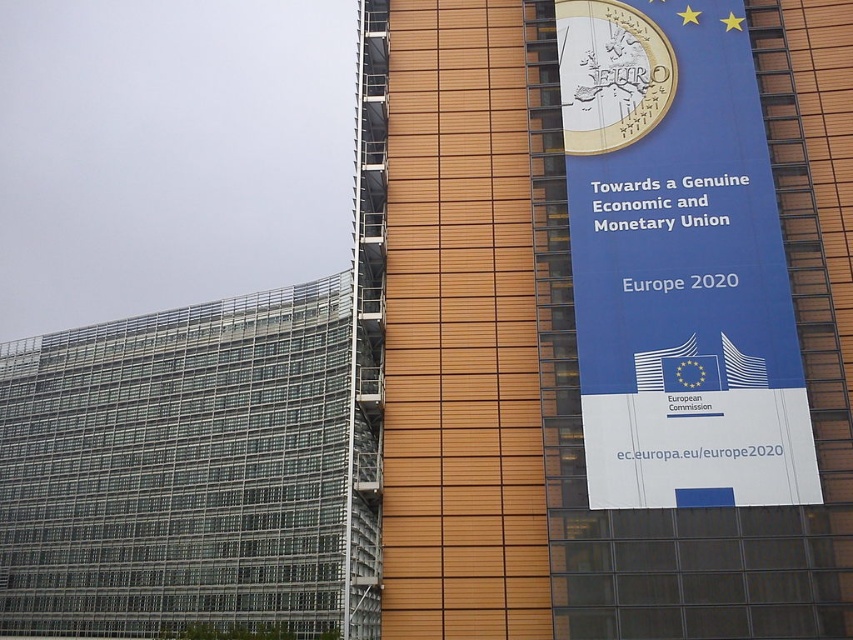
Question: Which object appears closest to the camera in this image?

Choices:
 (A) blue paper banner at upper right
 (B) blue fabric banner at upper center

Answer: (B)

Question: Is blue fabric banner at upper center above blue paper banner at upper right?

Choices:
 (A) no
 (B) yes

Answer: (A)

Question: Is blue fabric banner at upper center positioned at the back of blue paper banner at upper right?

Choices:
 (A) yes
 (B) no

Answer: (B)

Question: Which of the following is the closest to the observer?

Choices:
 (A) (633, 481)
 (B) (679, 621)

Answer: (B)

Question: Does blue fabric banner at upper center have a larger size compared to blue paper banner at upper right?

Choices:
 (A) yes
 (B) no

Answer: (A)